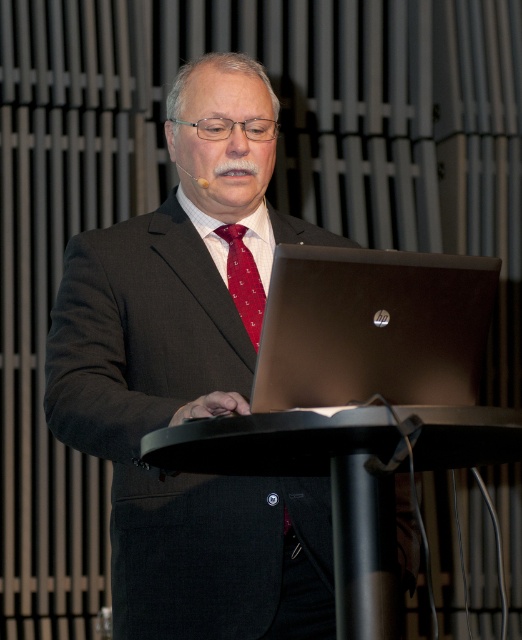
You are an event planner arranging the stage for a presentation. The black plastic podium at center needs to be positioned so that the silky red tie at center of the speaker is visible to the audience. Based on their current positions, is the podium placed correctly?

The black plastic podium at center is below the silky red tie at center, so the podium is positioned correctly because the podium being lower allows the tie to be visible above it to the audience.

You are a photographer at the back of the room. You want to take a photo of the man at the podium. The man is standing at the podium, and you need to focus on his face. However, there is a point at coordinates (348, 477) in the image. Can you tell me if this point is on the podium or the man?

The point at coordinates (348, 477) is on the black plastic podium at center, as per the provided description.

You are organizing a presentation and need to ensure that the laptop fits in your bag. The bag has a compartment that can only accommodate items smaller than the silky red tie at center. Based on the scene, will the satin black laptop at center fit in the compartment?

The satin black laptop at center is bigger than the silky red tie at center, so it will not fit in the compartment designed for items smaller than the silky red tie at center.